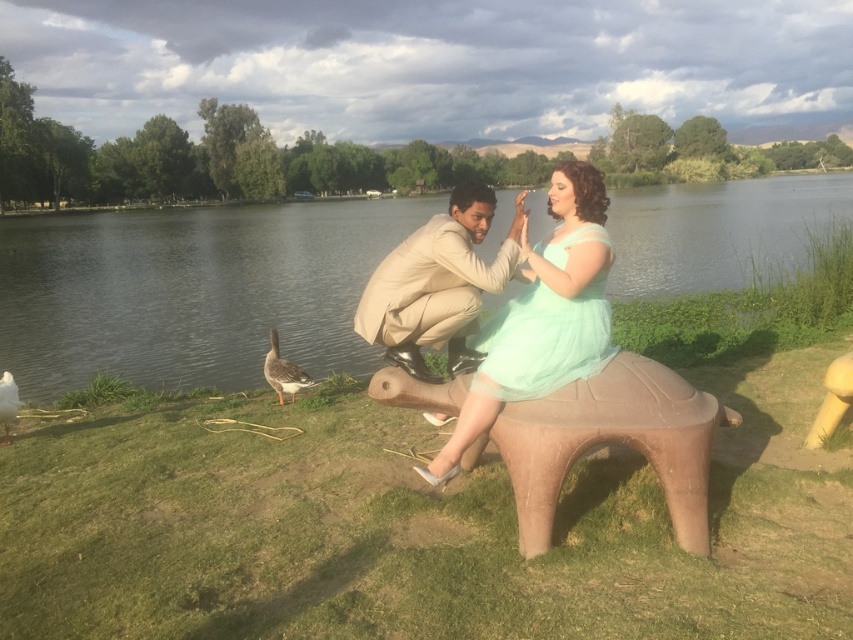
Between point (712, 259) and point (288, 362), which one is positioned behind?

Positioned behind is point (712, 259).

Who is taller, smooth brown water at center or brown feathered goose at lower left?

smooth brown water at center is taller.

Between point (113, 225) and point (289, 387), which one is positioned behind?

The point (113, 225) is more distant.

The height and width of the screenshot is (640, 853). Identify the location of smooth brown water at center. (190, 291).

Between point (602, 305) and point (381, 260), which one is positioned in front?

Point (602, 305) is more forward.

Does point (563, 204) lie in front of point (381, 300)?

Yes, point (563, 204) is in front of point (381, 300).

This screenshot has height=640, width=853. What do you see at coordinates (543, 316) in the screenshot?
I see `mint green tulle dress at center` at bounding box center [543, 316].

This screenshot has height=640, width=853. I want to click on mint green tulle dress at center, so click(x=543, y=316).

Which is more to the right, mint green tulle dress at center or brown feathered goose at lower left?

Positioned to the right is mint green tulle dress at center.

Is point (558, 173) closer to camera compared to point (289, 376)?

Yes, point (558, 173) is closer to viewer.

You are a GUI agent. You are given a task and a screenshot of the screen. Output one action in this format:
    pyautogui.click(x=<x>, y=<y>)
    Task: Click on the mint green tulle dress at center
    The image size is (853, 640).
    Given the screenshot: What is the action you would take?
    pyautogui.click(x=543, y=316)